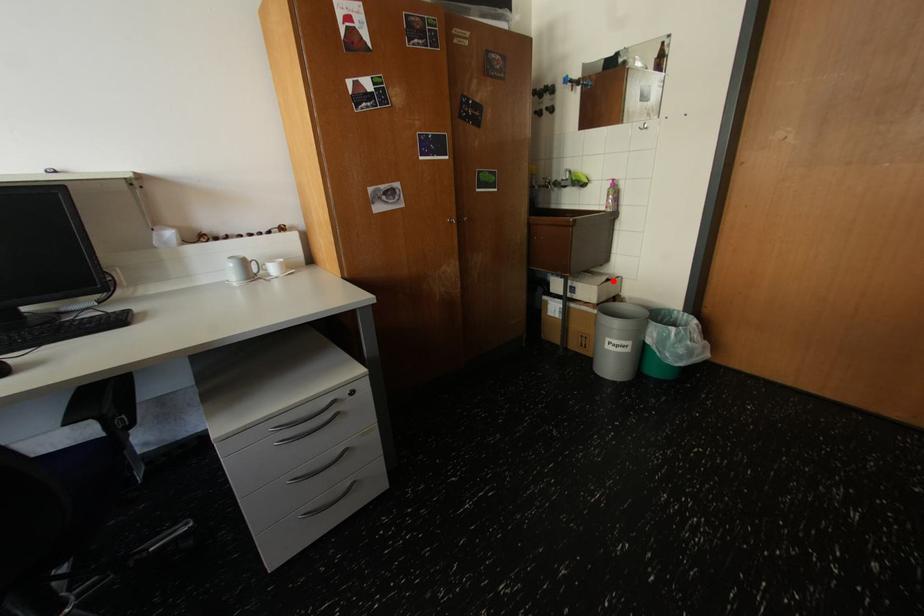
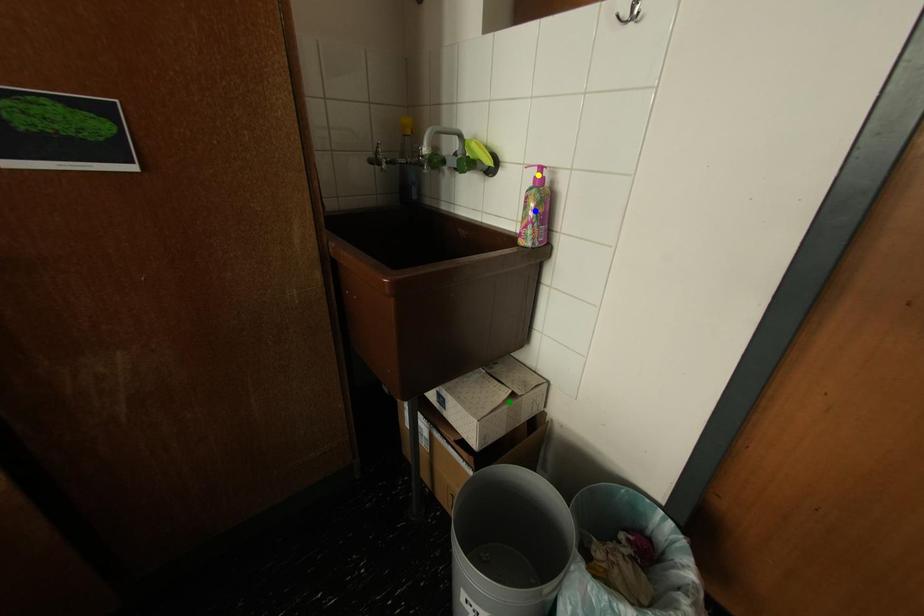
Question: I am providing you with two images of the same scene from different viewpoints. A red point is marked on the first image. You are given multiple points on the second image. Which point in image 2 represents the same 3d spot as the red point in image 1?

Choices:
 (A) green point
 (B) blue point
 (C) yellow point

Answer: (A)